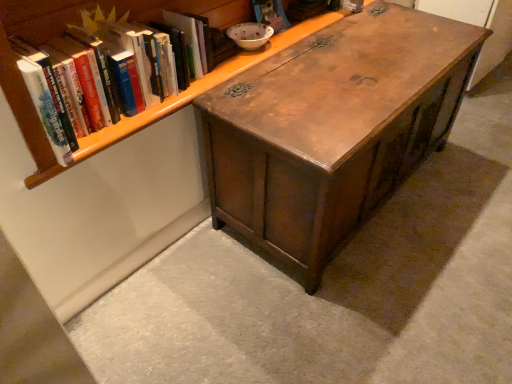
Locate an element on the screen. The height and width of the screenshot is (384, 512). hardcover book at upper left is located at coordinates (136, 59).

Describe the element at coordinates (136, 59) in the screenshot. I see `hardcover book at upper left` at that location.

Image resolution: width=512 pixels, height=384 pixels. In order to click on wooden chest at center in this screenshot , I will do `click(332, 129)`.

At what (x,y) coordinates should I click in order to perform the action: click on book behind the wooden bookshelf at upper left. Please return your answer as a coordinate pair (x, y). Looking at the image, I should click on (136, 59).

Considering the sizes of objects wooden bookshelf at upper left and hardcover book at upper left in the image provided, who is taller, wooden bookshelf at upper left or hardcover book at upper left?

wooden bookshelf at upper left is taller.

Between wooden bookshelf at upper left and hardcover book at upper left, which one has larger width?

wooden bookshelf at upper left.

Is wooden bookshelf at upper left oriented towards hardcover book at upper left?

Yes.

Is hardcover book at upper left facing towards wooden bookshelf at upper left?

Yes, hardcover book at upper left is oriented towards wooden bookshelf at upper left.

Would you consider hardcover book at upper left to be distant from wooden bookshelf at upper left?

No, there isn't a large distance between hardcover book at upper left and wooden bookshelf at upper left.

Considering the relative sizes of hardcover book at upper left and wooden bookshelf at upper left in the image provided, is hardcover book at upper left taller than wooden bookshelf at upper left?

No, hardcover book at upper left is not taller than wooden bookshelf at upper left.

How far apart are hardcover book at upper left and wooden bookshelf at upper left?

A distance of 4.75 inches exists between hardcover book at upper left and wooden bookshelf at upper left.

What's the angular difference between wooden bookshelf at upper left and wooden chest at center's facing directions?

0.000705 degrees separate the facing orientations of wooden bookshelf at upper left and wooden chest at center.

Would you say wooden bookshelf at upper left is outside wooden chest at center?

Absolutely, wooden bookshelf at upper left is external to wooden chest at center.

From a real-world perspective, relative to wooden chest at center, is wooden bookshelf at upper left vertically above or below?

Clearly, from a real-world perspective, wooden bookshelf at upper left is above wooden chest at center.

Is the depth of wooden bookshelf at upper left greater than that of wooden chest at center?

No, wooden bookshelf at upper left is closer to the viewer.

Considering the positions of point (321, 115) and point (229, 67), is point (321, 115) closer or farther from the camera than point (229, 67)?

Point (321, 115) is closer to the camera than point (229, 67).

Is wooden chest at center inside or outside of wooden bookshelf at upper left?

The correct answer is: outside.

Where is `bookcase on the left of wooden chest at center`? This screenshot has height=384, width=512. bookcase on the left of wooden chest at center is located at coordinates (200, 87).

From the picture: Which object is wider, wooden chest at center or wooden bookshelf at upper left?

Wider between the two is wooden chest at center.

Considering the relative sizes of hardcover book at upper left and wooden chest at center in the image provided, is hardcover book at upper left bigger than wooden chest at center?

Incorrect, hardcover book at upper left is not larger than wooden chest at center.

From the image's perspective, which one is positioned higher, hardcover book at upper left or wooden chest at center?

hardcover book at upper left is shown above in the image.

Considering the relative sizes of hardcover book at upper left and wooden chest at center in the image provided, is hardcover book at upper left wider than wooden chest at center?

In fact, hardcover book at upper left might be narrower than wooden chest at center.

Is wooden chest at center with hardcover book at upper left?

No, wooden chest at center is not making contact with hardcover book at upper left.

Between wooden chest at center and hardcover book at upper left, which one appears on the right side from the viewer's perspective?

wooden chest at center.

Considering the sizes of objects wooden chest at center and hardcover book at upper left in the image provided, who is smaller, wooden chest at center or hardcover book at upper left?

hardcover book at upper left is smaller.

Where is `bookcase positioned vertically above the hardcover book at upper left (from a real-world perspective)`? The image size is (512, 384). bookcase positioned vertically above the hardcover book at upper left (from a real-world perspective) is located at coordinates (200, 87).

Where is `book below the wooden bookshelf at upper left (from a real-world perspective)`? The image size is (512, 384). book below the wooden bookshelf at upper left (from a real-world perspective) is located at coordinates click(136, 59).

Consider the image. From the image, which object appears to be nearer to wooden bookshelf at upper left, wooden chest at center or hardcover book at upper left?

hardcover book at upper left.

Based on their spatial positions, is hardcover book at upper left or wooden bookshelf at upper left closer to wooden chest at center?

The object closer to wooden chest at center is wooden bookshelf at upper left.

From the image, which object appears to be farther from wooden bookshelf at upper left, hardcover book at upper left or wooden chest at center?

The object further to wooden bookshelf at upper left is wooden chest at center.

Estimate the real-world distances between objects in this image. Which object is closer to hardcover book at upper left, wooden chest at center or wooden bookshelf at upper left?

wooden bookshelf at upper left is closer to hardcover book at upper left.

Based on their spatial positions, is wooden bookshelf at upper left or hardcover book at upper left further from wooden chest at center?

hardcover book at upper left.

Looking at the image, which one is located further to hardcover book at upper left, wooden bookshelf at upper left or wooden chest at center?

The object further to hardcover book at upper left is wooden chest at center.

Where is `bookcase located between hardcover book at upper left and wooden chest at center in the left-right direction`? bookcase located between hardcover book at upper left and wooden chest at center in the left-right direction is located at coordinates (200, 87).